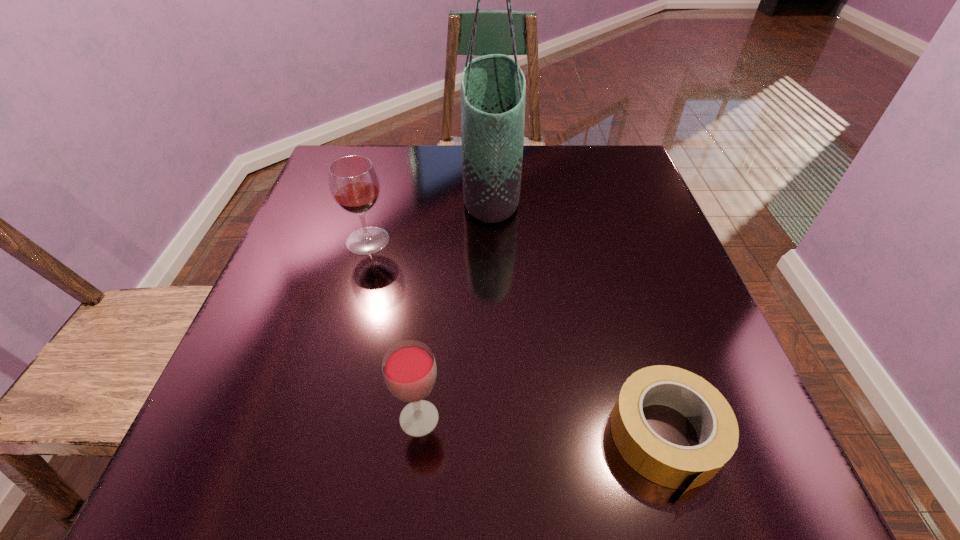
The image size is (960, 540). I want to click on the tallest object, so click(493, 88).

Find the location of a particular element. This screenshot has width=960, height=540. the third object from left to right is located at coordinates (493, 88).

Locate an element on the screen. the third nearest object is located at coordinates (353, 181).

Locate an element on the screen. This screenshot has height=540, width=960. the second tallest object is located at coordinates (353, 181).

Identify the location of the third object from right to left. This screenshot has width=960, height=540. (409, 369).

Find the location of a particular element. The height and width of the screenshot is (540, 960). the nearer wineglass is located at coordinates (409, 369).

Image resolution: width=960 pixels, height=540 pixels. I want to click on the shortest object, so click(677, 467).

This screenshot has width=960, height=540. Find the location of `duct tape`. duct tape is located at coordinates (677, 467).

Locate an element on the screen. This screenshot has width=960, height=540. vacant space positioned on the left of the farthest object is located at coordinates (420, 185).

Identify the location of vacant space positioned on the right of the second farthest object. (454, 241).